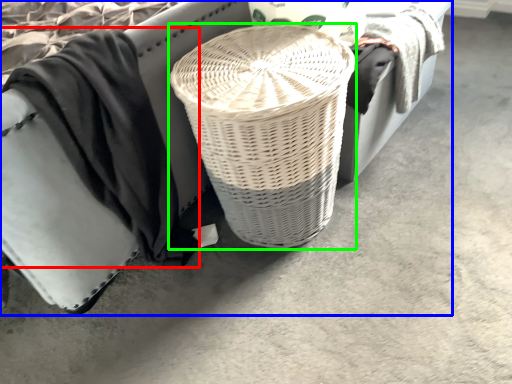
Question: Estimate the real-world distances between objects in this image. Which object is farther from clothing (highlighted by a red box), furniture (highlighted by a blue box) or basket (highlighted by a green box)?

Choices:
 (A) furniture
 (B) basket

Answer: (B)